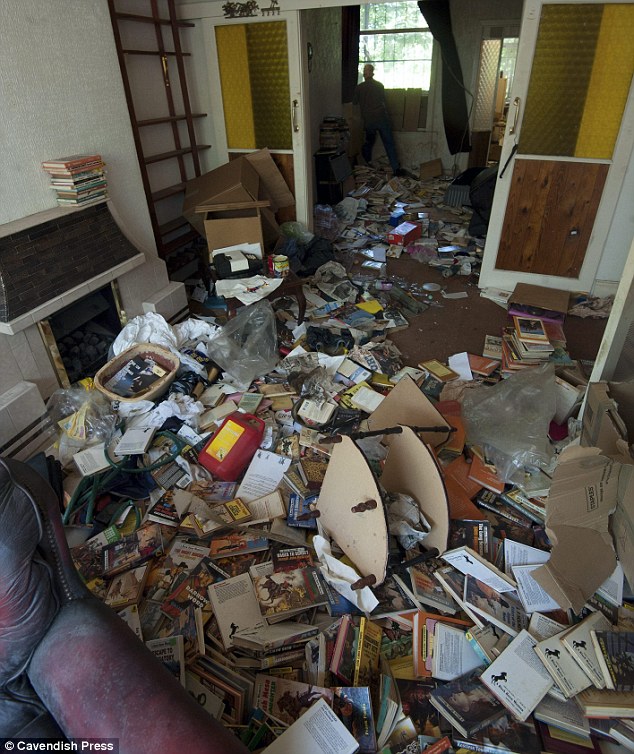
This screenshot has height=754, width=634. Identify the location of windows. (399, 51).